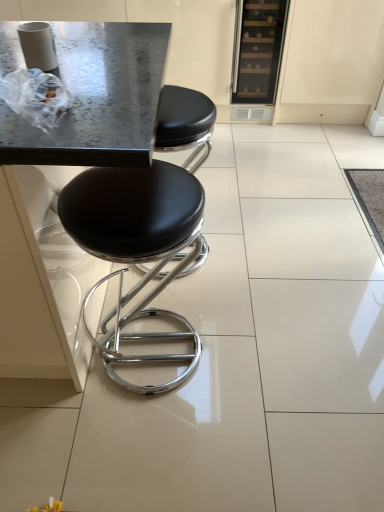
The height and width of the screenshot is (512, 384). I want to click on metallic gray table at center, so click(x=74, y=165).

Find the location of a particular element. black leather stool at center is located at coordinates (146, 228).

In terms of height, does matte glass wine cooler at upper right look taller or shorter compared to black leather stool at center?

Considering their sizes, matte glass wine cooler at upper right has less height than black leather stool at center.

Considering the positions of points (271, 96) and (171, 103), is point (271, 96) closer to camera compared to point (171, 103)?

No.

How far apart are matte glass wine cooler at upper right and black leather stool at center?

matte glass wine cooler at upper right and black leather stool at center are 4.65 feet apart.

Is the surface of matte glass wine cooler at upper right in direct contact with black leather stool at center?

matte glass wine cooler at upper right is not next to black leather stool at center, and they're not touching.

Would you say black leather stool at center is inside or outside metallic gray table at center?

black leather stool at center is contained in metallic gray table at center.

From the image's perspective, who appears lower, black leather stool at center or metallic gray table at center?

black leather stool at center is shown below in the image.

Based on the photo, is black leather stool at center to the right of metallic gray table at center from the viewer's perspective?

Indeed, black leather stool at center is positioned on the right side of metallic gray table at center.

Between black leather stool at center and metallic gray table at center, which one has larger size?

metallic gray table at center.

From the image's perspective, who appears lower, matte glass wine cooler at upper right or metallic gray table at center?

metallic gray table at center appears lower in the image.

Is matte glass wine cooler at upper right wider or thinner than metallic gray table at center?

Considering their sizes, matte glass wine cooler at upper right looks slimmer than metallic gray table at center.

Considering the sizes of matte glass wine cooler at upper right and metallic gray table at center in the image, is matte glass wine cooler at upper right bigger or smaller than metallic gray table at center?

matte glass wine cooler at upper right is smaller than metallic gray table at center.

Could you tell me if matte glass wine cooler at upper right is facing metallic gray table at center?

No, matte glass wine cooler at upper right is not aimed at metallic gray table at center.

Is metallic gray table at center bigger than matte glass wine cooler at upper right?

Indeed, metallic gray table at center has a larger size compared to matte glass wine cooler at upper right.

From a real-world perspective, which object stands above the other?

From a 3D spatial view, metallic gray table at center is above.

Is metallic gray table at center to the left of matte glass wine cooler at upper right from the viewer's perspective?

Yes, metallic gray table at center is to the left of matte glass wine cooler at upper right.

Does metallic gray table at center turn towards matte glass wine cooler at upper right?

No, metallic gray table at center is not oriented towards matte glass wine cooler at upper right.

Is black leather stool at center facing away from matte glass wine cooler at upper right?

No.

From the image's perspective, is black leather stool at center on top of matte glass wine cooler at upper right?

No, from the image's perspective, black leather stool at center is not over matte glass wine cooler at upper right.

From a real-world perspective, is black leather stool at center located beneath matte glass wine cooler at upper right?

Yes, from a real-world perspective, black leather stool at center is beneath matte glass wine cooler at upper right.

Between metallic gray table at center and black leather stool at center, which one is positioned in front?

metallic gray table at center is closer to the camera.

Considering the relative positions of metallic gray table at center and black leather stool at center in the image provided, is metallic gray table at center to the left or to the right of black leather stool at center?

Based on their positions, metallic gray table at center is located to the left of black leather stool at center.

From the picture: Are metallic gray table at center and black leather stool at center beside each other?

metallic gray table at center and black leather stool at center are not in contact.

Identify the location of appliance that appears above the black leather stool at center (from the image's perspective). (258, 50).

There is a black leather stool at center. At what (x,y) coordinates should I click in order to perform the action: click on round table above it (from a real-world perspective). Please return your answer as a coordinate pair (x, y). The width and height of the screenshot is (384, 512). Looking at the image, I should click on (74, 165).

Considering their positions, is metallic gray table at center positioned further to black leather stool at center than matte glass wine cooler at upper right?

matte glass wine cooler at upper right lies further to black leather stool at center than the other object.

Based on their spatial positions, is black leather stool at center or metallic gray table at center closer to matte glass wine cooler at upper right?

Based on the image, black leather stool at center appears to be nearer to matte glass wine cooler at upper right.

From the image, which object appears to be farther from metallic gray table at center, black leather stool at center or matte glass wine cooler at upper right?

The object further to metallic gray table at center is matte glass wine cooler at upper right.

Estimate the real-world distances between objects in this image. Which object is further from matte glass wine cooler at upper right, metallic gray table at center or black leather stool at center?

Among the two, metallic gray table at center is located further to matte glass wine cooler at upper right.

Looking at the image, which one is located closer to metallic gray table at center, matte glass wine cooler at upper right or black leather stool at center?

black leather stool at center is closer to metallic gray table at center.

Considering their positions, is matte glass wine cooler at upper right positioned closer to black leather stool at center than metallic gray table at center?

metallic gray table at center lies closer to black leather stool at center than the other object.

I want to click on stool positioned between metallic gray table at center and matte glass wine cooler at upper right from near to far, so click(x=146, y=228).